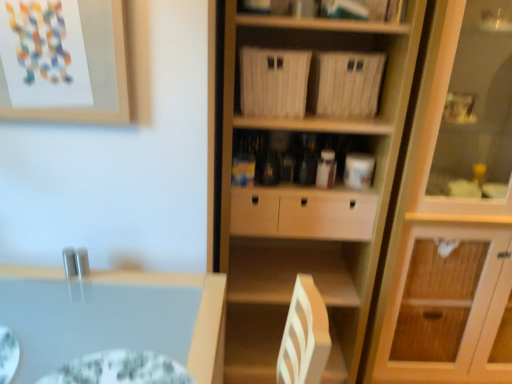
Question: Is light wood cabinet at right not within matte paper picture frame at upper left?

Choices:
 (A) yes
 (B) no

Answer: (A)

Question: From a real-world perspective, does light wood cabinet at right stand above matte paper picture frame at upper left?

Choices:
 (A) no
 (B) yes

Answer: (A)

Question: Is matte paper picture frame at upper left surrounded by light wood cabinet at right?

Choices:
 (A) no
 (B) yes

Answer: (A)

Question: Does light wood cabinet at right have a lesser height compared to matte paper picture frame at upper left?

Choices:
 (A) no
 (B) yes

Answer: (A)

Question: Does light wood cabinet at right turn towards matte paper picture frame at upper left?

Choices:
 (A) no
 (B) yes

Answer: (A)

Question: From the image's perspective, is light wood cabinet at right above matte paper picture frame at upper left?

Choices:
 (A) yes
 (B) no

Answer: (B)

Question: From the image's perspective, does green textured glass plate at lower left appear lower than light wood cabinet at right?

Choices:
 (A) no
 (B) yes

Answer: (B)

Question: Is green textured glass plate at lower left facing towards light wood cabinet at right?

Choices:
 (A) yes
 (B) no

Answer: (B)

Question: Is green textured glass plate at lower left wider than light wood cabinet at right?

Choices:
 (A) no
 (B) yes

Answer: (A)

Question: Is green textured glass plate at lower left oriented away from light wood cabinet at right?

Choices:
 (A) yes
 (B) no

Answer: (B)

Question: Does green textured glass plate at lower left lie in front of light wood cabinet at right?

Choices:
 (A) no
 (B) yes

Answer: (B)

Question: Is green textured glass plate at lower left located outside light wood cabinet at right?

Choices:
 (A) yes
 (B) no

Answer: (A)

Question: Does green textured glass plate at lower left appear on the right side of matte paper picture frame at upper left?

Choices:
 (A) no
 (B) yes

Answer: (B)